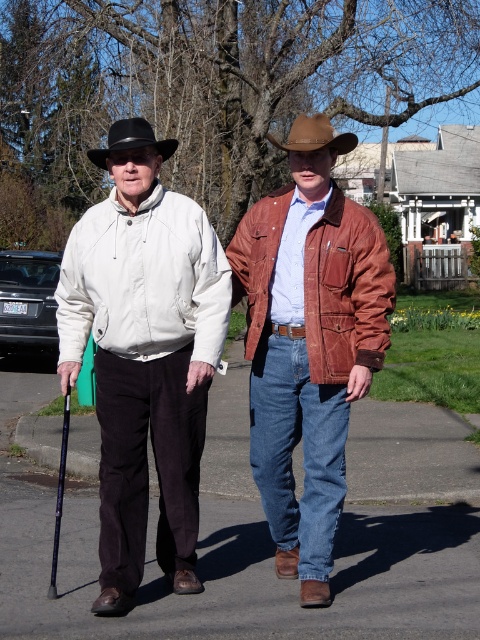
Who is more forward, (188, 241) or (320, 468)?

Point (188, 241) is in front.

This screenshot has width=480, height=640. I want to click on white matte jacket at center, so click(x=144, y=355).

The width and height of the screenshot is (480, 640). I want to click on white matte jacket at center, so [144, 355].

Is suede brown jacket at center above brown leather cowboy hat at center?

Incorrect, suede brown jacket at center is not positioned above brown leather cowboy hat at center.

Which is in front, point (330, 452) or point (325, 128)?

Positioned in front is point (325, 128).

Is point (280, 241) positioned behind point (298, 145)?

Yes, point (280, 241) is behind point (298, 145).

At what (x,y) coordinates should I click in order to perform the action: click on suede brown jacket at center. Please return your answer as a coordinate pair (x, y). Looking at the image, I should click on (309, 352).

Can you confirm if white matte jacket at center is positioned to the right of black felt fedora at upper center?

Yes, white matte jacket at center is to the right of black felt fedora at upper center.

Does white matte jacket at center have a larger size compared to black felt fedora at upper center?

Actually, white matte jacket at center might be smaller than black felt fedora at upper center.

Which is in front, point (171, 236) or point (104, 148)?

Point (171, 236) is more forward.

Find the location of a particular element. white matte jacket at center is located at coordinates (144, 355).